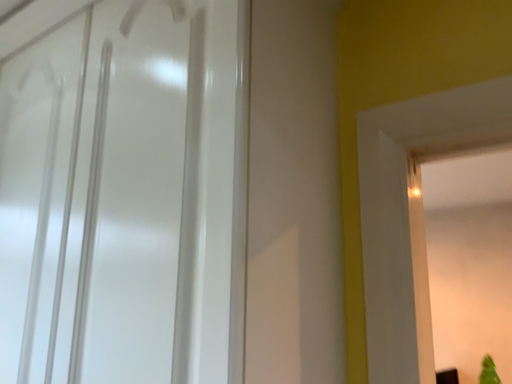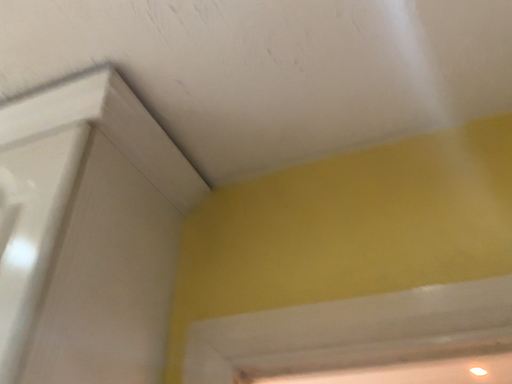
Question: Which way did the camera rotate in the video?

Choices:
 (A) rotated upward
 (B) rotated downward

Answer: (A)